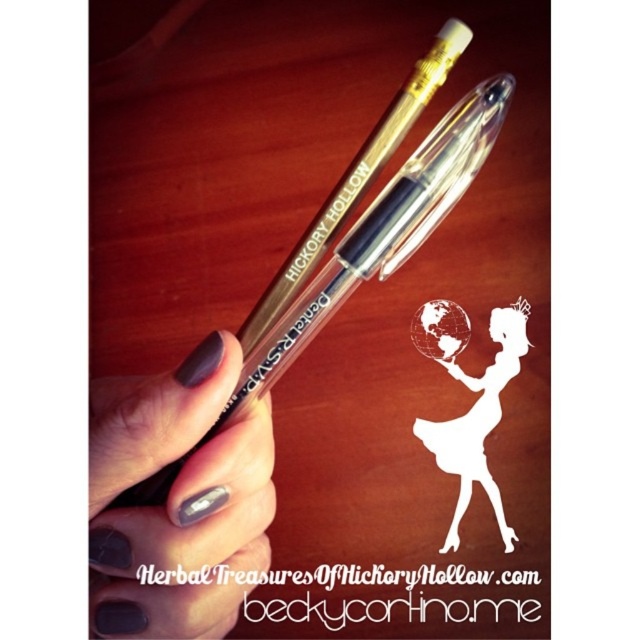
Question: Which is nearer to the white paper silhouette at center?

Choices:
 (A) clear plastic pen at center
 (B) matte gray nail polish at lower left

Answer: (A)

Question: Does matte gray nail polish at lower left come behind clear plastic pen at center?

Choices:
 (A) no
 (B) yes

Answer: (A)

Question: Does matte gray nail polish at lower left appear over white paper silhouette at center?

Choices:
 (A) no
 (B) yes

Answer: (A)

Question: Considering the real-world distances, which object is closest to the clear plastic pen at center?

Choices:
 (A) matte gray nail polish at lower left
 (B) white paper silhouette at center

Answer: (A)

Question: Can you confirm if clear plastic pen at center is smaller than white paper silhouette at center?

Choices:
 (A) yes
 (B) no

Answer: (B)

Question: Which of the following is the farthest from the observer?

Choices:
 (A) white paper silhouette at center
 (B) matte gray nail polish at lower left

Answer: (A)